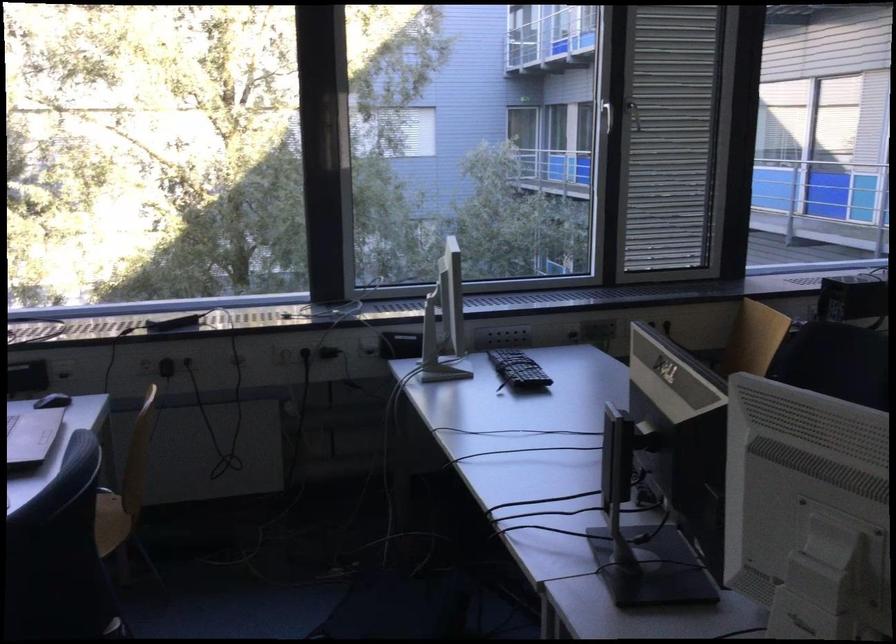
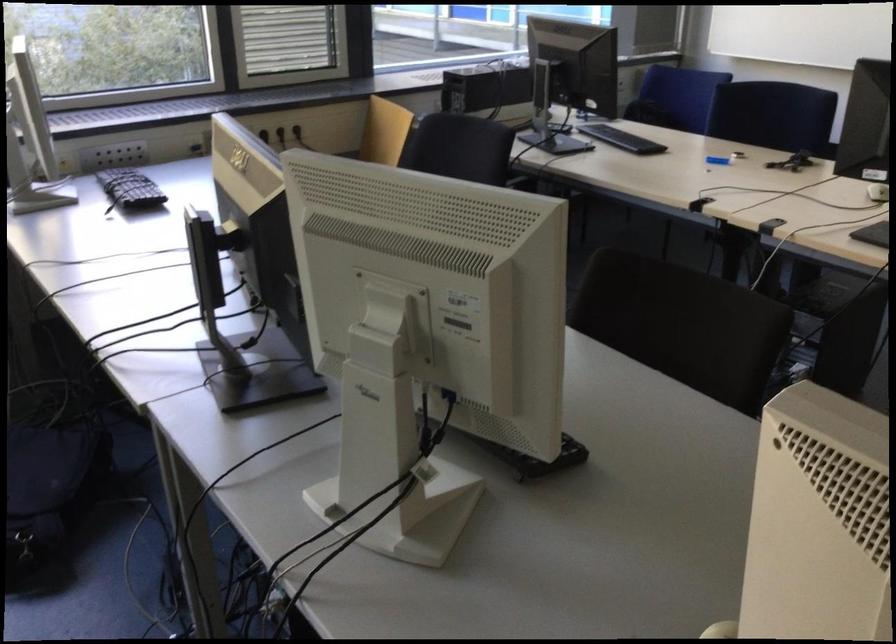
Question: Based on the continuous images, in which direction is the camera rotating? Reply with the corresponding letter.

Choices:
 (A) Left
 (B) Right
 (C) Up
 (D) Down

Answer: (B)